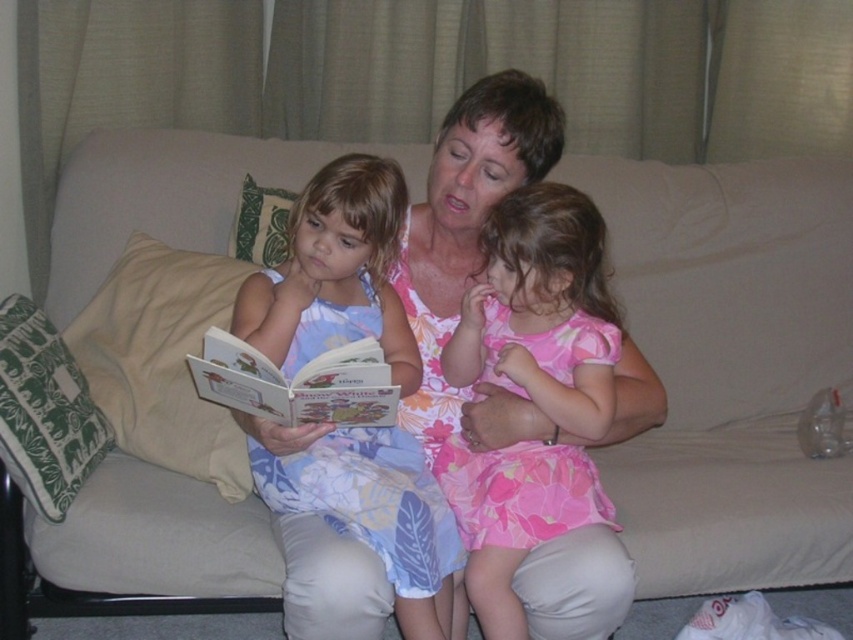
Between light blue floral dress at center and pink floral dress at center, which one is positioned lower?

Positioned lower is light blue floral dress at center.

Measure the distance between light blue floral dress at center and camera.

light blue floral dress at center and camera are 1.44 meters apart.

You are a GUI agent. You are given a task and a screenshot of the screen. Output one action in this format:
    pyautogui.click(x=<x>, y=<y>)
    Task: Click on the light blue floral dress at center
    The height and width of the screenshot is (640, 853).
    Given the screenshot: What is the action you would take?
    pyautogui.click(x=335, y=273)

Does pink floral dress at center appear under matte paper book at center?

Yes.

Describe the element at coordinates (543, 308) in the screenshot. This screenshot has height=640, width=853. I see `pink floral dress at center` at that location.

Locate an element on the screen. This screenshot has height=640, width=853. pink floral dress at center is located at coordinates (543, 308).

Which is behind, point (241, 292) or point (16, 428)?

The point (241, 292) is behind.

How distant is light blue floral dress at center from green printed fabric pillow at left?

17.95 inches

Find the location of `light blue floral dress at center`. light blue floral dress at center is located at coordinates (335, 273).